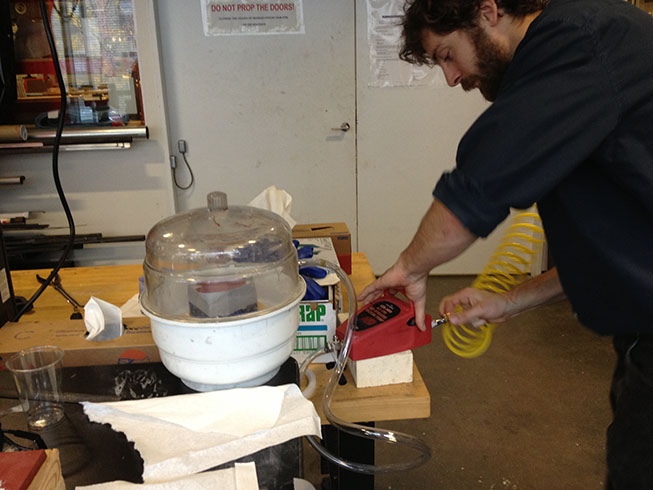
The image size is (653, 490). Identify the location of door. (303, 178).